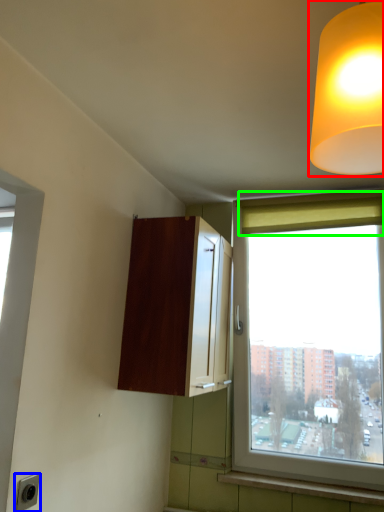
Question: Based on their relative distances, which object is farther from lamp (highlighted by a red box)? Choose from electric outlet (highlighted by a blue box) and curtain (highlighted by a green box).

Choices:
 (A) electric outlet
 (B) curtain

Answer: (B)